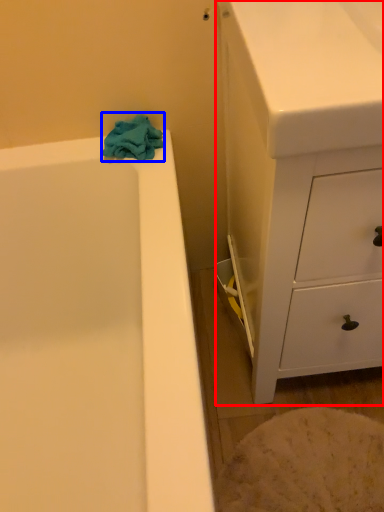
Question: Which of the following is the closest to the observer, chest of drawers (highlighted by a red box) or bath towel (highlighted by a blue box)?

Choices:
 (A) chest of drawers
 (B) bath towel

Answer: (A)